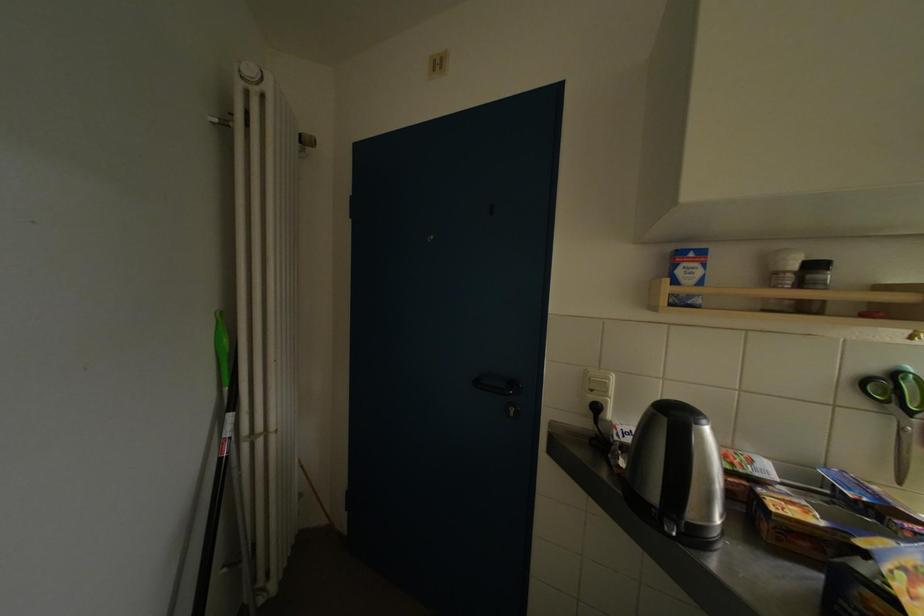
At what (x,y) coordinates should I click in order to perform the action: click on radiator control knob. Please return your answer as a coordinate pair (x, y). Looking at the image, I should click on (249, 71).